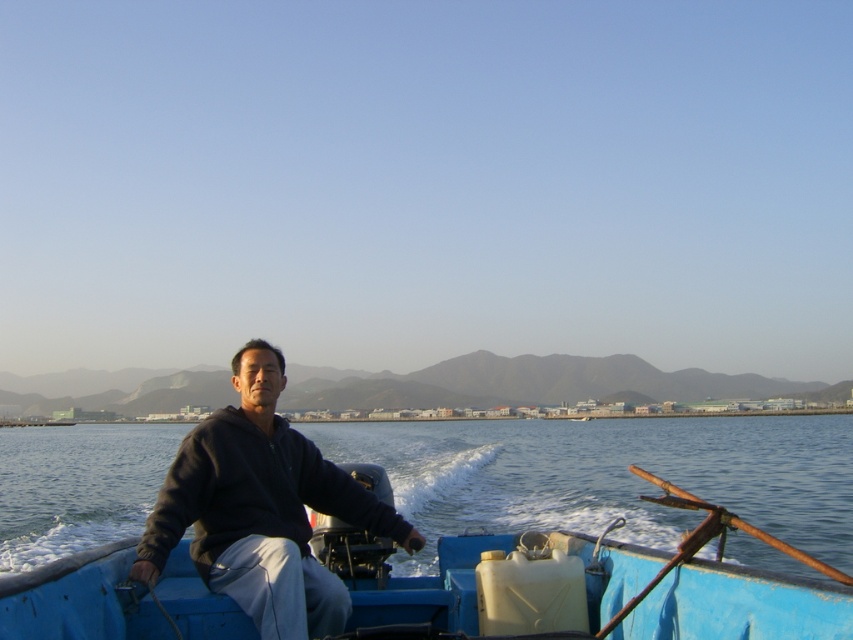
Question: Does blue water at center have a larger size compared to dark blue sweatshirt at center?

Choices:
 (A) no
 (B) yes

Answer: (B)

Question: Among these points, which one is nearest to the camera?

Choices:
 (A) (241, 605)
 (B) (642, 492)

Answer: (A)

Question: Is blue water at center positioned behind dark blue sweatshirt at center?

Choices:
 (A) yes
 (B) no

Answer: (A)

Question: Is blue water at center in front of dark blue sweatshirt at center?

Choices:
 (A) no
 (B) yes

Answer: (A)

Question: Which of the following is the closest to the observer?

Choices:
 (A) blue water at center
 (B) dark blue sweatshirt at center

Answer: (B)